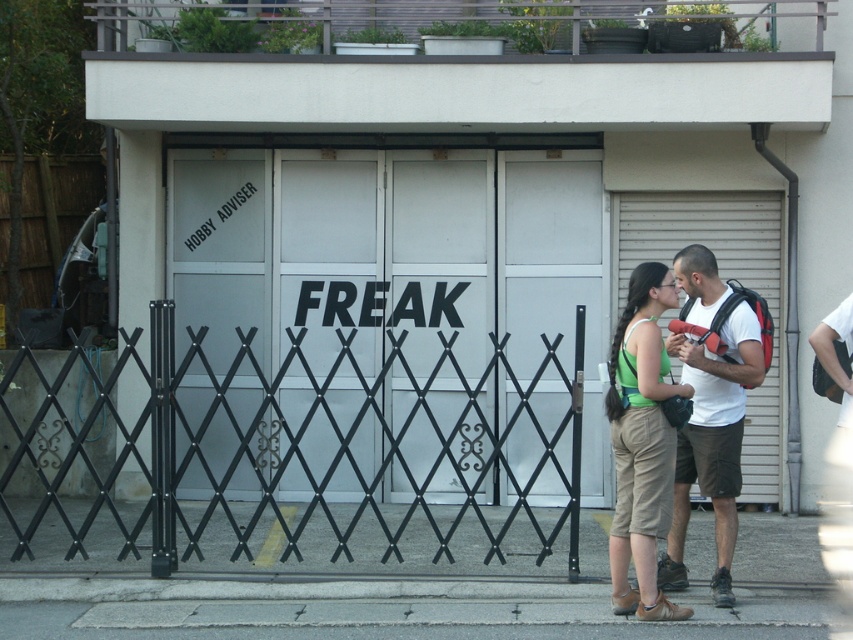
Question: In this image, where is green fabric tank top at lower center located relative to white matte t-shirt at center?

Choices:
 (A) left
 (B) right

Answer: (A)

Question: Considering the real-world distances, which object is closest to the green fabric tank top at lower center?

Choices:
 (A) matte glass garage door at center
 (B) black metal fence at center

Answer: (B)

Question: Which object appears farthest from the camera in this image?

Choices:
 (A) matte glass garage door at center
 (B) black metal fence at center
 (C) green fabric tank top at lower center
 (D) white matte t-shirt at center

Answer: (A)

Question: Which of the following is the farthest from the observer?

Choices:
 (A) (537, 554)
 (B) (375, 230)
 (C) (671, 444)

Answer: (B)

Question: From the image, what is the correct spatial relationship of matte glass garage door at center in relation to black metal fence at center?

Choices:
 (A) right
 (B) left

Answer: (A)

Question: Considering the relative positions of matte glass garage door at center and white matte t-shirt at center in the image provided, where is matte glass garage door at center located with respect to white matte t-shirt at center?

Choices:
 (A) below
 (B) above

Answer: (B)